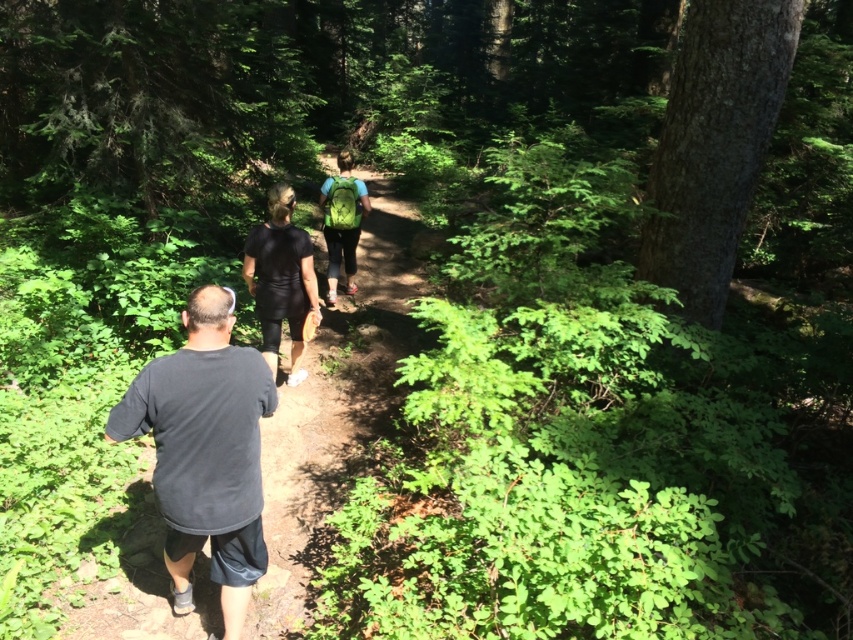
Can you confirm if black fabric backpack at center is bigger than dark gray t-shirt at center?

No, black fabric backpack at center is not bigger than dark gray t-shirt at center.

Is black fabric backpack at center to the left of dark gray t-shirt at center from the viewer's perspective?

In fact, black fabric backpack at center is to the right of dark gray t-shirt at center.

Where is `black fabric backpack at center`? Image resolution: width=853 pixels, height=640 pixels. black fabric backpack at center is located at coordinates (222, 413).

Locate an element on the screen. This screenshot has width=853, height=640. black fabric backpack at center is located at coordinates (222, 413).